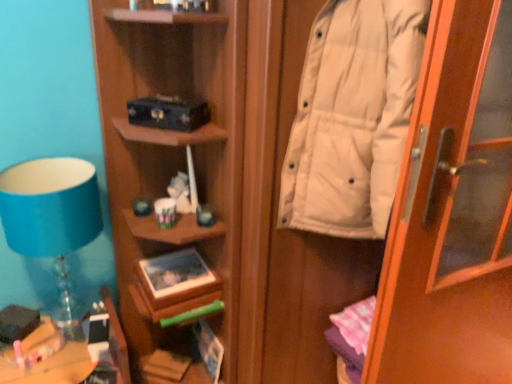
Question: Is matte black book at upper center, which is counted as the fourth book, starting from the bottom, positioned beyond the bounds of white matte door at right?

Choices:
 (A) no
 (B) yes

Answer: (B)

Question: From the image's perspective, does matte black book at upper center, the 1th book in the top-to-bottom sequence, appear lower than white matte door at right?

Choices:
 (A) no
 (B) yes

Answer: (A)

Question: Does matte black book at upper center, which is counted as the fourth book, starting from the bottom, touch white matte door at right?

Choices:
 (A) no
 (B) yes

Answer: (A)

Question: Does matte black book at upper center, the 1th book in the top-to-bottom sequence, have a lesser width compared to white matte door at right?

Choices:
 (A) yes
 (B) no

Answer: (A)

Question: Is matte black book at upper center, which is counted as the fourth book, starting from the bottom, facing towards white matte door at right?

Choices:
 (A) yes
 (B) no

Answer: (B)

Question: In the image, is matte black book at upper center, which is counted as the fourth book, starting from the bottom, positioned in front of or behind wooden desk at lower left?

Choices:
 (A) behind
 (B) front

Answer: (A)

Question: From a real-world perspective, relative to wooden desk at lower left, is matte black book at upper center, which is counted as the fourth book, starting from the bottom, vertically above or below?

Choices:
 (A) above
 (B) below

Answer: (A)

Question: Considering the positions of matte black book at upper center, the 1th book in the top-to-bottom sequence, and wooden desk at lower left in the image, is matte black book at upper center, the 1th book in the top-to-bottom sequence, taller or shorter than wooden desk at lower left?

Choices:
 (A) tall
 (B) short

Answer: (B)

Question: From the image's perspective, is matte black book at upper center, the 1th book in the top-to-bottom sequence, above or below wooden desk at lower left?

Choices:
 (A) above
 (B) below

Answer: (A)

Question: Visually, is matte black book at upper center, which is counted as the fourth book, starting from the bottom, positioned to the left or to the right of white matte coat at right?

Choices:
 (A) left
 (B) right

Answer: (A)

Question: Considering their positions, is matte black book at upper center, which is counted as the fourth book, starting from the bottom, located in front of or behind white matte coat at right?

Choices:
 (A) behind
 (B) front

Answer: (A)

Question: Is matte black book at upper center, which is counted as the fourth book, starting from the bottom, bigger or smaller than white matte coat at right?

Choices:
 (A) small
 (B) big

Answer: (A)

Question: Does point (206, 107) appear closer or farther from the camera than point (333, 210)?

Choices:
 (A) closer
 (B) farther

Answer: (B)

Question: Based on their sizes in the image, would you say matte blue book at lower center, the 3th book from the top, is bigger or smaller than white matte door at right?

Choices:
 (A) big
 (B) small

Answer: (B)

Question: Is point (215, 382) closer or farther from the camera than point (413, 117)?

Choices:
 (A) farther
 (B) closer

Answer: (A)